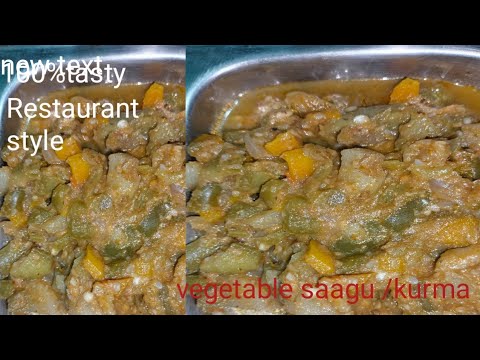
Locate an element on the screen. plate is located at coordinates (162, 63), (353, 60).